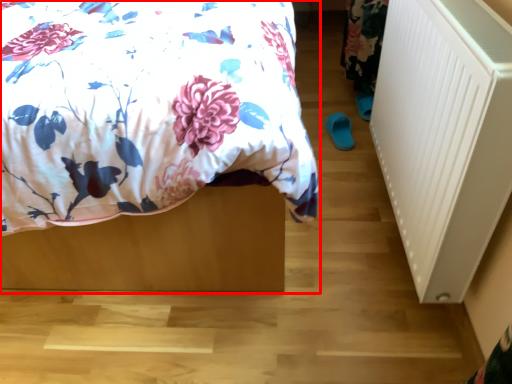
Question: From the image's perspective, where is bed (annotated by the red box) located relative to radiator?

Choices:
 (A) above
 (B) below

Answer: (A)